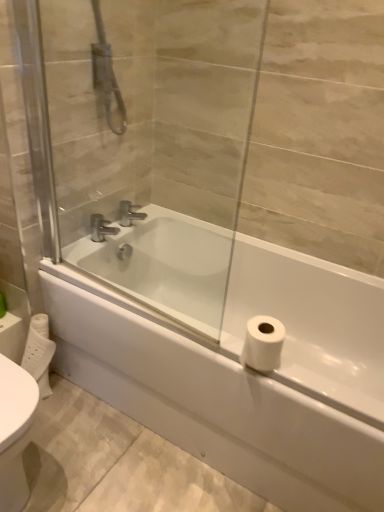
You are a GUI agent. You are given a task and a screenshot of the screen. Output one action in this format:
    pyautogui.click(x=<x>, y=<y>)
    Task: Click on the free spot below transparent glass screen door at upper center (from a real-world perspective)
    
    Given the screenshot: What is the action you would take?
    pyautogui.click(x=124, y=300)